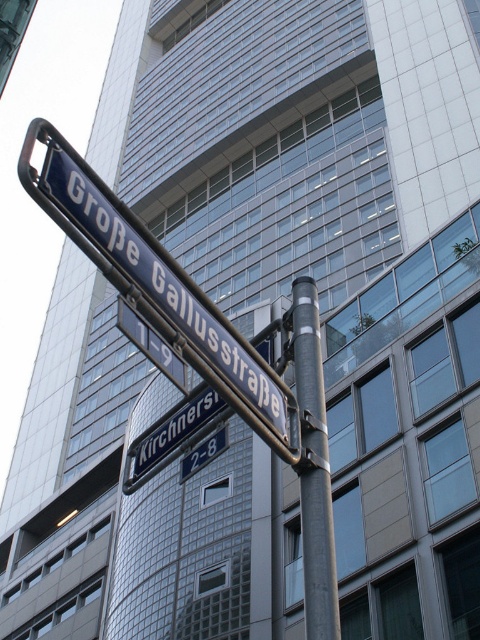
You are a city planner analyzing street sign placements. You see the metallic blue street sign at center and the metallic gray pole at center. Which object is taller?

The metallic blue street sign at center is taller than the metallic gray pole at center.

You are a city planner assessing the street layout. You notice the metallic blue street sign at center and the metallic gray pole at center. Which object is wider from the perspective of someone standing directly in front of them?

The metallic blue street sign at center is wider than the metallic gray pole at center.

You are a delivery driver who needs to read the address on the metallic blue street sign at center. Can you see the metallic gray pole at center behind the sign?

The metallic blue street sign at center is in front of the metallic gray pole at center, so yes, the driver can see the pole behind the sign.